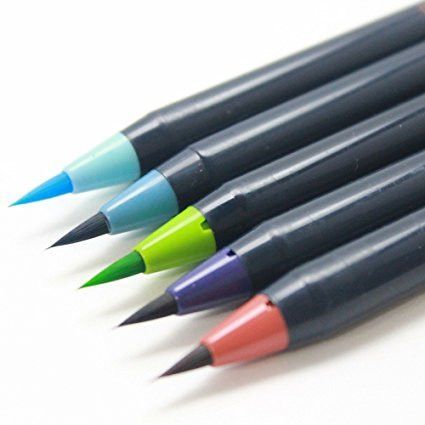
Where is `marker`? The image size is (425, 425). marker is located at coordinates (310, 306), (280, 240), (263, 193), (220, 152), (155, 128).